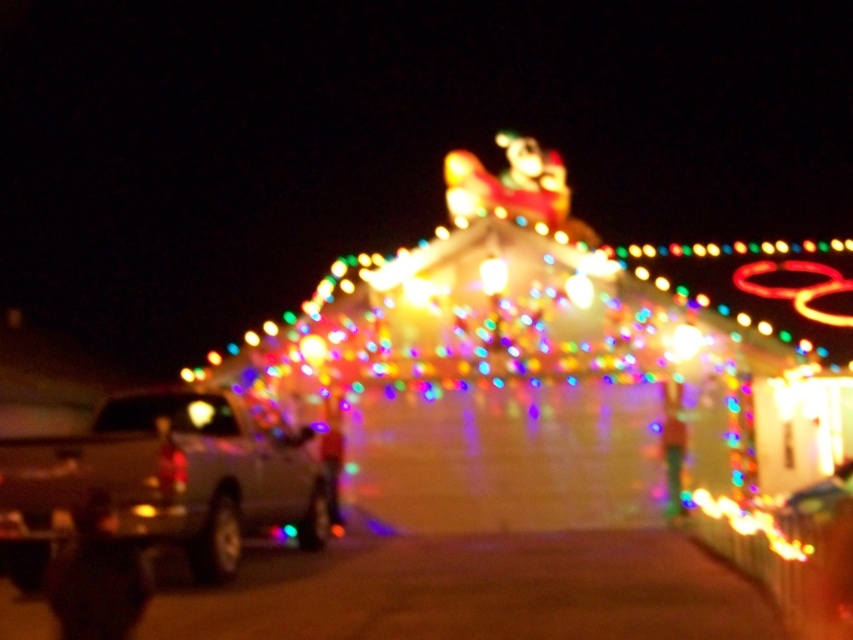
Question: Which object appears farthest from the camera in this image?

Choices:
 (A) metallic silver car at right
 (B) metallic silver truck at left

Answer: (B)

Question: Is metallic silver truck at left above metallic silver car at right?

Choices:
 (A) yes
 (B) no

Answer: (A)

Question: Which object appears closest to the camera in this image?

Choices:
 (A) metallic silver truck at left
 (B) metallic silver car at right

Answer: (B)

Question: Can you confirm if metallic silver truck at left is smaller than metallic silver car at right?

Choices:
 (A) no
 (B) yes

Answer: (B)

Question: Can you confirm if metallic silver truck at left is bigger than metallic silver car at right?

Choices:
 (A) no
 (B) yes

Answer: (A)